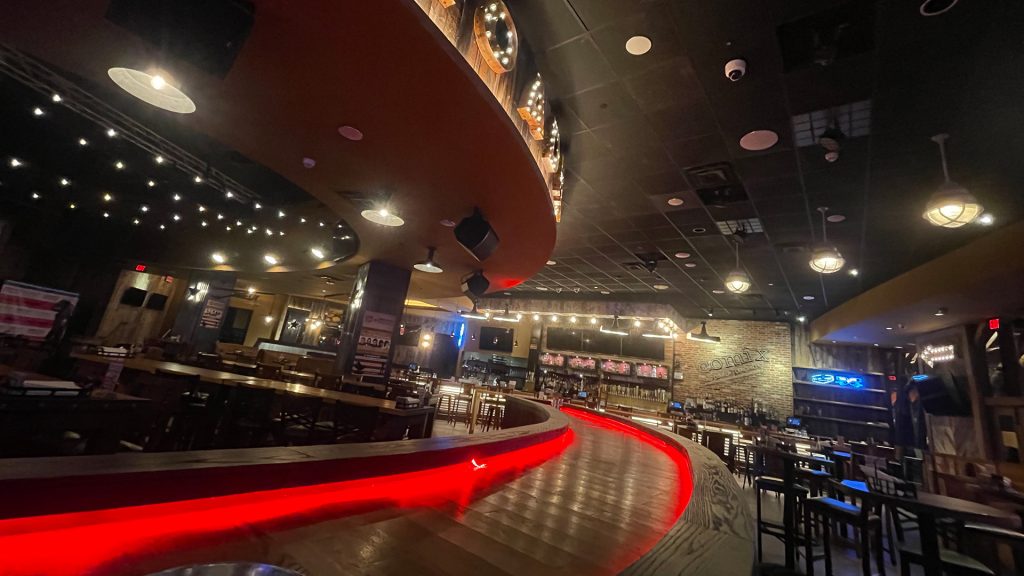
Find the location of a particular element. light is located at coordinates (156, 82).